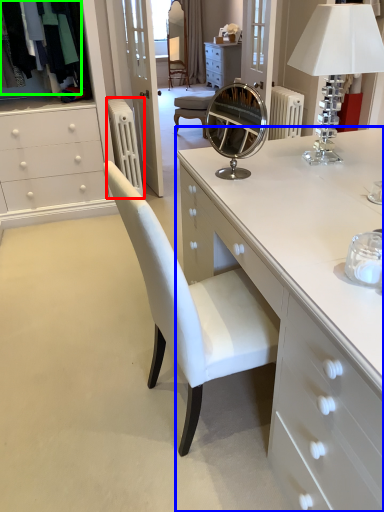
Question: Considering the real-world distances, which object is farthest from radiator (highlighted by a red box)? chest of drawers (highlighted by a blue box) or clothing (highlighted by a green box)?

Choices:
 (A) chest of drawers
 (B) clothing

Answer: (A)